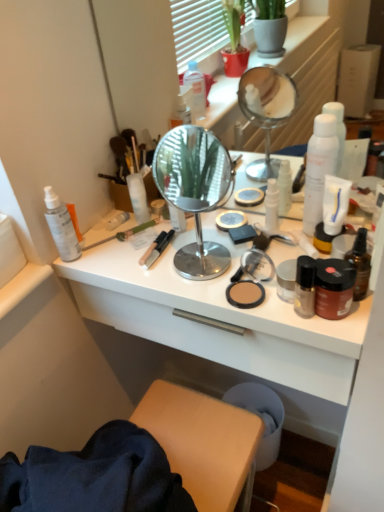
Where is `vacant space situated on the left part of brown matte jar at right, which is the seventh toiletry from left to right`? vacant space situated on the left part of brown matte jar at right, which is the seventh toiletry from left to right is located at coordinates (246, 301).